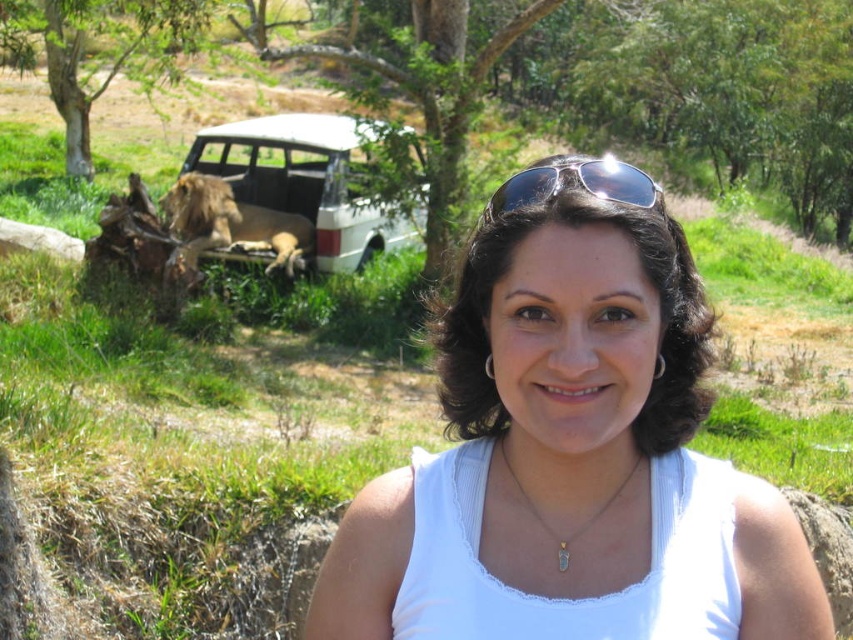
Who is positioned more to the right, golden fur lion at left or gold chain at center?

gold chain at center

Between golden fur lion at left and gold chain at center, which one is positioned lower?

gold chain at center is lower down.

You are a GUI agent. You are given a task and a screenshot of the screen. Output one action in this format:
    pyautogui.click(x=<x>, y=<y>)
    Task: Click on the golden fur lion at left
    Image resolution: width=853 pixels, height=640 pixels.
    Given the screenshot: What is the action you would take?
    pyautogui.click(x=231, y=225)

In the scene shown: Between white matte car at center and sunglasses at center, which one has more height?

Standing taller between the two is sunglasses at center.

Is point (177, 196) positioned before point (555, 172)?

No, (177, 196) is further to viewer.

Where is `white matte car at center`? This screenshot has height=640, width=853. white matte car at center is located at coordinates (283, 196).

The image size is (853, 640). I want to click on white matte car at center, so click(283, 196).

Is white matte car at center thinner than gold chain at center?

No, white matte car at center is not thinner than gold chain at center.

Which is more to the right, white matte car at center or gold chain at center?

From the viewer's perspective, gold chain at center appears more on the right side.

Image resolution: width=853 pixels, height=640 pixels. I want to click on white matte car at center, so click(x=283, y=196).